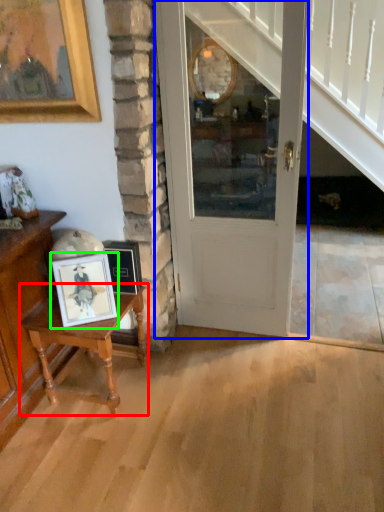
Question: Which is nearer to the table (highlighted by a red box)? door (highlighted by a blue box) or picture frame (highlighted by a green box).

Choices:
 (A) door
 (B) picture frame

Answer: (B)